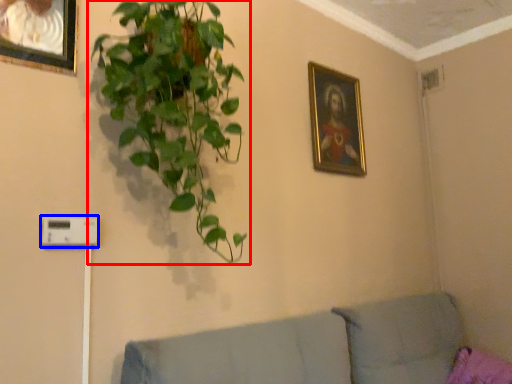
Question: Which object appears farthest to the camera in this image, houseplant (highlighted by a red box) or light switch (highlighted by a blue box)?

Choices:
 (A) houseplant
 (B) light switch

Answer: (B)